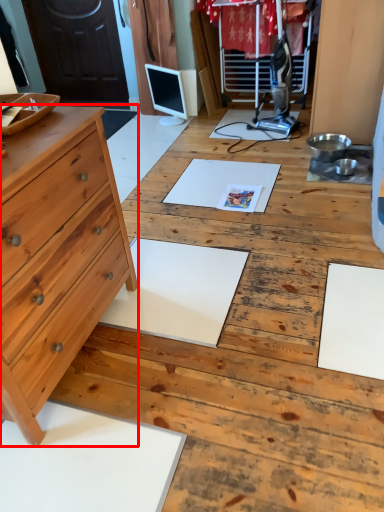
Question: From the image's perspective, what is the correct spatial relationship of chest of drawers (annotated by the red box) in relation to computer monitor?

Choices:
 (A) above
 (B) below

Answer: (B)